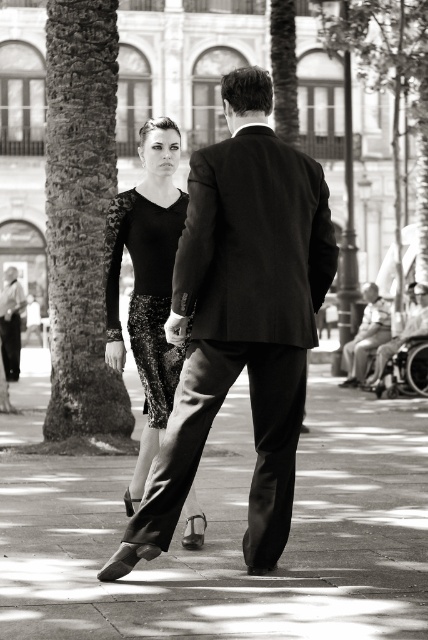
Is the position of smooth concrete pavement at center less distant than that of sparkly black dress at center?

Yes, smooth concrete pavement at center is closer to the viewer.

Does smooth concrete pavement at center appear under sparkly black dress at center?

Correct, smooth concrete pavement at center is located below sparkly black dress at center.

Is point (308, 625) in front of point (166, 387)?

That is True.

Locate an element on the screen. The image size is (428, 640). smooth concrete pavement at center is located at coordinates (231, 536).

Which is behind, point (175, 234) or point (382, 326)?

Positioned behind is point (382, 326).

Find the location of a particular element. sparkly black dress at center is located at coordinates (145, 291).

Between point (113, 292) and point (365, 291), which one is positioned behind?

Positioned behind is point (365, 291).

The image size is (428, 640). What are the coordinates of `sparkly black dress at center` in the screenshot? It's located at (145, 291).

Consider the image. Does sequined fabric dress at center appear under light beige suit at right?

No, sequined fabric dress at center is not below light beige suit at right.

Which is behind, point (155, 269) or point (374, 346)?

Positioned behind is point (374, 346).

Where is `sequined fabric dress at center`? This screenshot has height=640, width=428. sequined fabric dress at center is located at coordinates (146, 285).

This screenshot has width=428, height=640. I want to click on sequined fabric dress at center, so click(x=146, y=285).